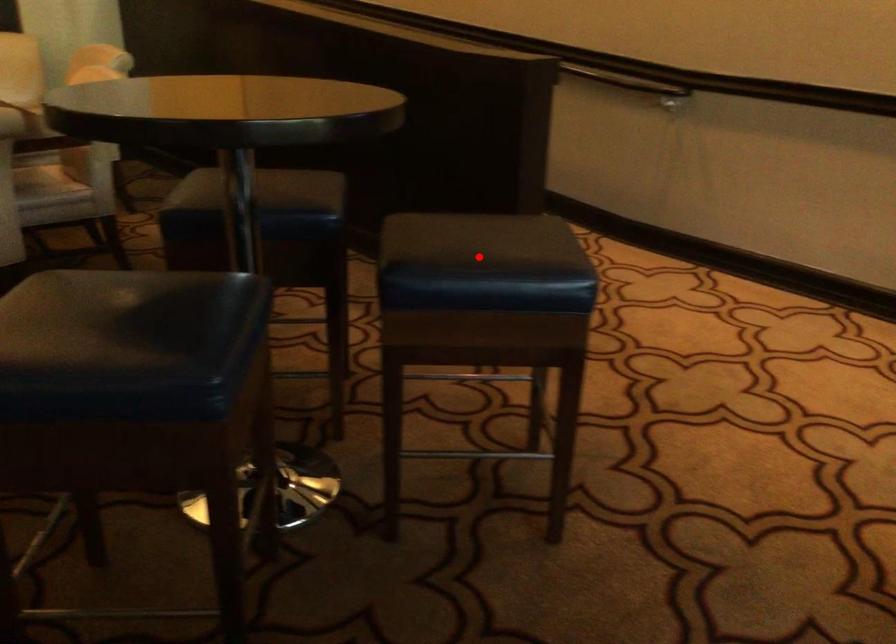
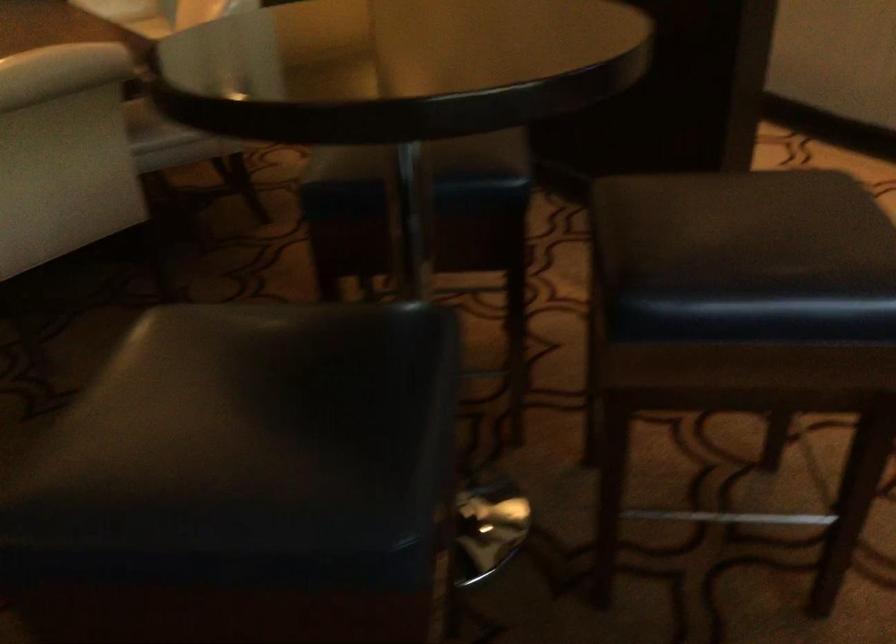
Question: I am providing you with two images of the same scene from different viewpoints. Given a red point in image1, look at the same physical point in image2. Is it:

Choices:
 (A) Closer to the viewpoint
 (B) Farther from the viewpoint

Answer: (A)